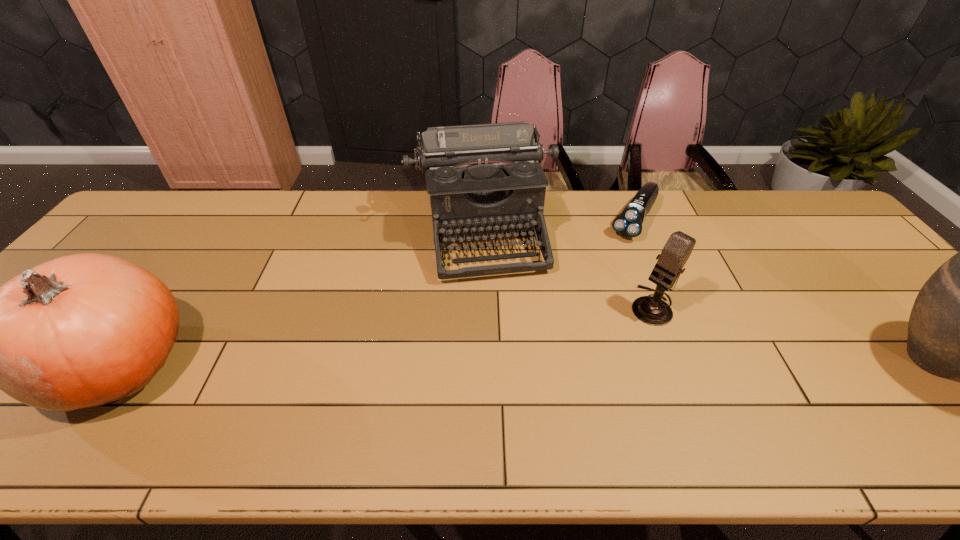
This screenshot has width=960, height=540. Find the location of `the shortest object`. the shortest object is located at coordinates (629, 223).

At what (x,y) coordinates should I click in order to perform the action: click on typewriter. Please return your answer as a coordinate pair (x, y). The width and height of the screenshot is (960, 540). Looking at the image, I should click on (x=482, y=179).

This screenshot has height=540, width=960. I want to click on microphone, so click(652, 310).

At what (x,y) coordinates should I click in order to perform the action: click on free location located 0.380m on the head of the shortest object. Please return your answer as a coordinate pair (x, y). Image resolution: width=960 pixels, height=540 pixels. Looking at the image, I should click on (573, 322).

Locate an element on the screen. The image size is (960, 540). vacant space located 0.110m on the head of the shortest object is located at coordinates (612, 261).

The width and height of the screenshot is (960, 540). I want to click on vacant space located 0.250m on the head of the shortest object, so click(x=593, y=291).

The image size is (960, 540). Find the location of `vacant point located on the typing side of the typewriter`. vacant point located on the typing side of the typewriter is located at coordinates (x=504, y=338).

Where is `free space located 0.130m on the typing side of the typewriter`? free space located 0.130m on the typing side of the typewriter is located at coordinates (501, 322).

At what (x,y) coordinates should I click in order to perform the action: click on vacant region located on the typing side of the typewriter. Please return your answer as a coordinate pair (x, y). The width and height of the screenshot is (960, 540). Looking at the image, I should click on [496, 301].

This screenshot has width=960, height=540. In order to click on free spot located on the front-facing side of the microphone in this screenshot , I will do `click(606, 349)`.